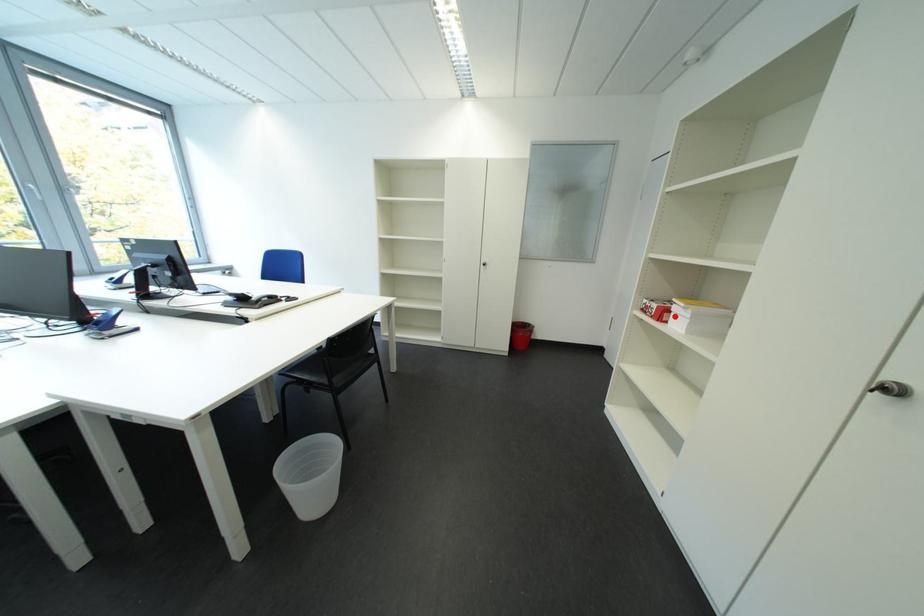
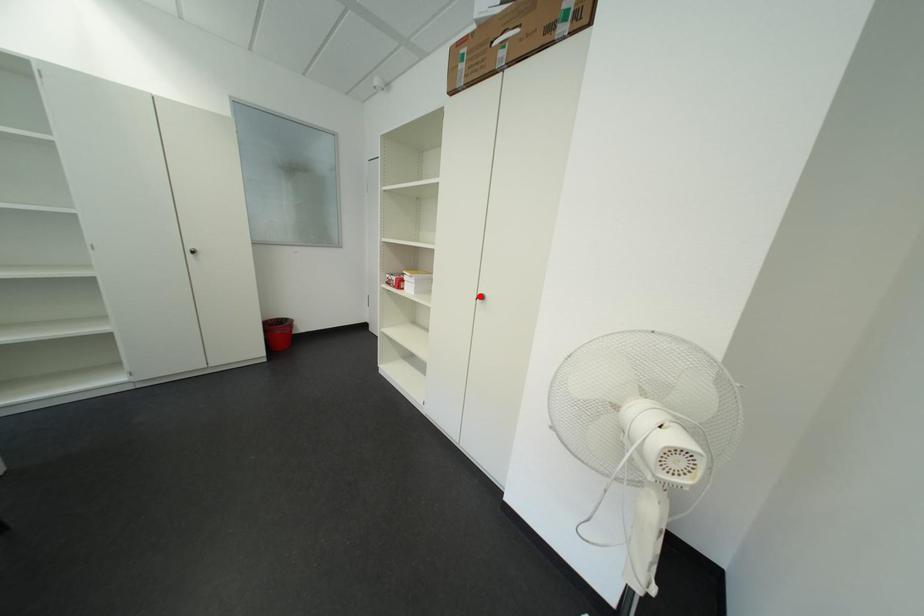
I am providing you with two images of the same scene from different viewpoints. A red point is marked on the first image and another point is marked on the second image. Is the red point in image1 aligned with the point shown in image2?

No